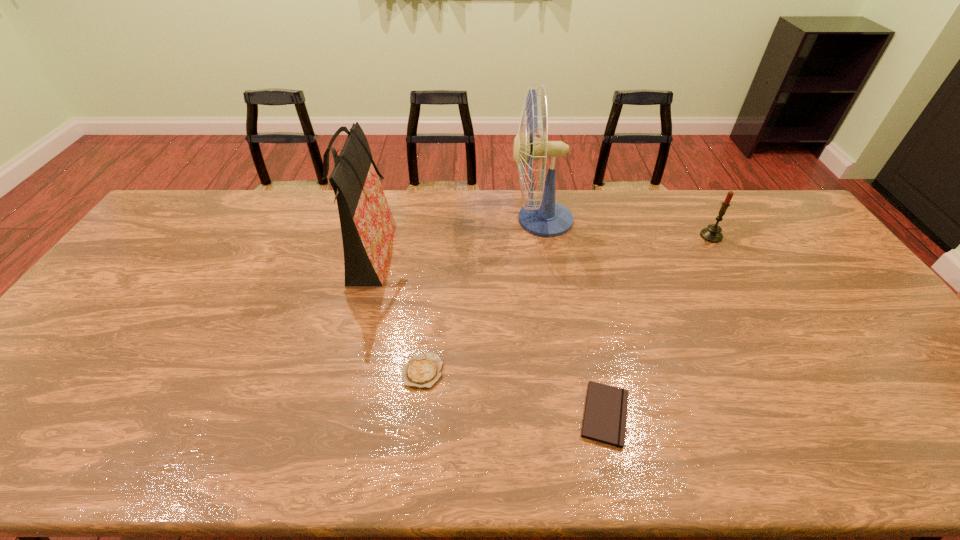
Locate an element on the screen. This screenshot has height=540, width=960. free region located 0.180m on the right of the candle is located at coordinates (776, 236).

Identify the location of free space located 0.290m on the left of the quiche. (285, 371).

Identify the location of vacant space located on the left of the checkbook. (503, 414).

This screenshot has width=960, height=540. I want to click on fan that is at the far edge, so coord(545,218).

Identify the location of shopping bag present at the far edge. (367, 225).

Find the location of a particular element. This screenshot has height=540, width=960. candle that is positioned at the far edge is located at coordinates (712, 233).

You are a GUI agent. You are given a task and a screenshot of the screen. Output one action in this format:
    pyautogui.click(x=<x>, y=<y>)
    Task: Click on the object situated at the near edge
    The image size is (960, 540).
    Given the screenshot: What is the action you would take?
    pyautogui.click(x=605, y=415)

At what (x,y) coordinates should I click in order to perform the action: click on vacant space at the far edge of the desktop. Please return your answer as a coordinate pair (x, y). The width and height of the screenshot is (960, 540). Looking at the image, I should click on (558, 193).

In the image, there is a desktop. Where is `vacant space at the near edge`? The height and width of the screenshot is (540, 960). vacant space at the near edge is located at coordinates (559, 453).

Where is `vacant space at the left edge of the desktop`? vacant space at the left edge of the desktop is located at coordinates (91, 327).